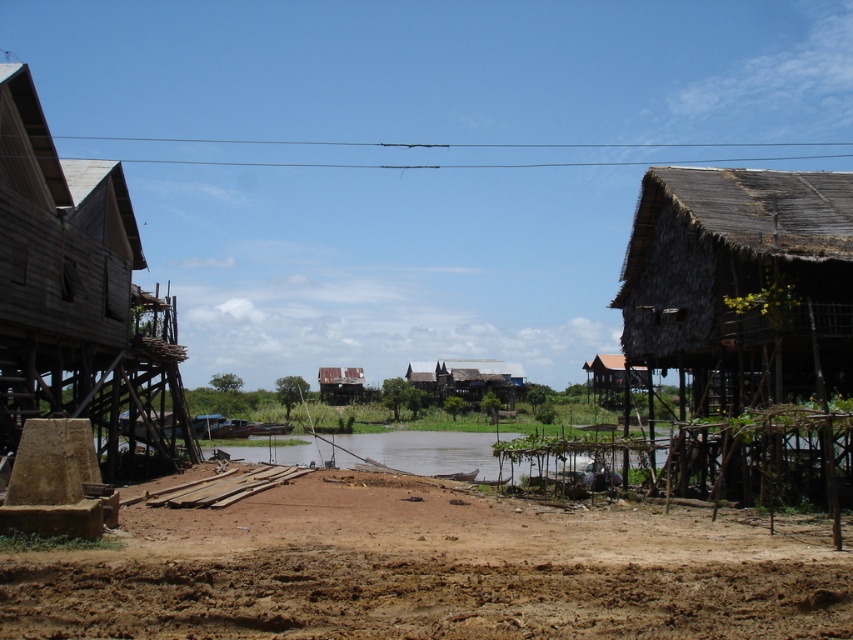
Can you confirm if brown sandy dirt field at lower center is positioned to the left of thatched wood hut at right?

Yes, brown sandy dirt field at lower center is to the left of thatched wood hut at right.

Based on the photo, does brown sandy dirt field at lower center have a greater height compared to thatched wood hut at right?

No.

Does point (456, 502) come closer to viewer compared to point (808, 369)?

Yes.

I want to click on brown sandy dirt field at lower center, so click(x=433, y=570).

Is thatched wood hut at right above rustic wooden houses at center?

Indeed, thatched wood hut at right is positioned over rustic wooden houses at center.

Locate an element on the screen. Image resolution: width=853 pixels, height=640 pixels. thatched wood hut at right is located at coordinates (740, 284).

What do you see at coordinates (740, 284) in the screenshot?
I see `thatched wood hut at right` at bounding box center [740, 284].

Where is `thatched wood hut at right`? thatched wood hut at right is located at coordinates (740, 284).

Is wooden hut at left wider than rustic wooden houses at center?

Incorrect, wooden hut at left's width does not surpass rustic wooden houses at center's.

Looking at this image, who is lower down, wooden hut at left or rustic wooden houses at center?

rustic wooden houses at center is lower down.

Locate an element on the screen. wooden hut at left is located at coordinates (79, 300).